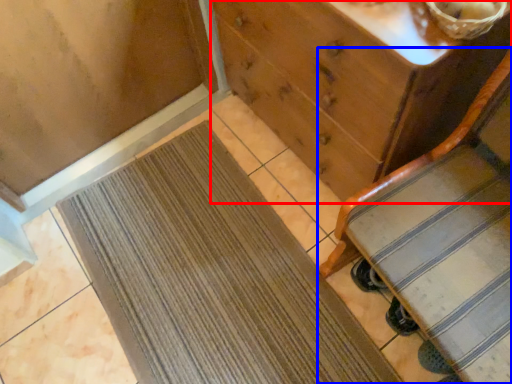
Question: Which of the following is the closest to the observer, chest of drawers (highlighted by a red box) or furniture (highlighted by a blue box)?

Choices:
 (A) chest of drawers
 (B) furniture

Answer: (B)